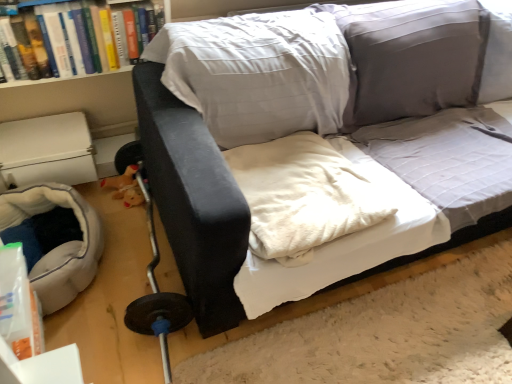
Locate an element on the screen. The image size is (512, 384). white soft blanket at center is located at coordinates (302, 196).

Describe the element at coordinates (57, 246) in the screenshot. I see `soft gray fabric bean bag at lower left` at that location.

This screenshot has height=384, width=512. I want to click on white soft blanket at center, so click(x=302, y=196).

Is soft gray fabric bean bag at lower left not inside hardcover book at upper left?

That's correct, soft gray fabric bean bag at lower left is outside of hardcover book at upper left.

In the scene shown: From a real-world perspective, which object stands above the other?

From a 3D spatial view, hardcover book at upper left is above.

From the image's perspective, would you say soft gray fabric bean bag at lower left is shown under hardcover book at upper left?

Correct, soft gray fabric bean bag at lower left appears lower than hardcover book at upper left in the image.

Where is `book above the velvet black couch at center (from the image's perspective)`? book above the velvet black couch at center (from the image's perspective) is located at coordinates (88, 37).

Is hardcover book at upper left oriented towards velvet black couch at center?

No, hardcover book at upper left is not aimed at velvet black couch at center.

From the image's perspective, is hardcover book at upper left located above or below velvet black couch at center?

Clearly, from the image's perspective, hardcover book at upper left is above velvet black couch at center.

Looking at the image, does hardcover book at upper left seem bigger or smaller compared to velvet black couch at center?

hardcover book at upper left is smaller than velvet black couch at center.

Can you confirm if white soft blanket at center is positioned to the right of hardcover book at upper left?

Correct, you'll find white soft blanket at center to the right of hardcover book at upper left.

Is point (275, 151) closer to viewer compared to point (131, 28)?

Yes.

Which object is further away from the camera taking this photo, white soft blanket at center or hardcover book at upper left?

hardcover book at upper left is further away from the camera.

Are white soft blanket at center and hardcover book at upper left located far from each other?

They are positioned close to each other.

Is there a large distance between hardcover book at upper left and white soft blanket at center?

That's not correct — hardcover book at upper left is a little close to white soft blanket at center.

Is hardcover book at upper left wider than white soft blanket at center?

No.

Is hardcover book at upper left completely or partially outside of white soft blanket at center?

Yes.

From the image's perspective, which one is positioned lower, white soft blanket at center or soft gray fabric bean bag at lower left?

From the image's view, soft gray fabric bean bag at lower left is below.

Is the surface of white soft blanket at center in direct contact with soft gray fabric bean bag at lower left?

white soft blanket at center is not next to soft gray fabric bean bag at lower left, and they're not touching.

This screenshot has height=384, width=512. I want to click on bean bag chair directly beneath the white soft blanket at center (from a real-world perspective), so click(57, 246).

Does white soft blanket at center have a smaller size compared to soft gray fabric bean bag at lower left?

Correct, white soft blanket at center occupies less space than soft gray fabric bean bag at lower left.

From a real-world perspective, is hardcover book at upper left positioned under soft gray fabric bean bag at lower left based on gravity?

Actually, hardcover book at upper left is physically above soft gray fabric bean bag at lower left in the real world.

What's the angular difference between hardcover book at upper left and soft gray fabric bean bag at lower left's facing directions?

89 degrees separate the facing orientations of hardcover book at upper left and soft gray fabric bean bag at lower left.

Is hardcover book at upper left oriented towards soft gray fabric bean bag at lower left?

No, hardcover book at upper left is not oriented towards soft gray fabric bean bag at lower left.

From their relative heights in the image, would you say hardcover book at upper left is taller or shorter than soft gray fabric bean bag at lower left?

hardcover book at upper left is taller than soft gray fabric bean bag at lower left.

Is point (478, 159) less distant than point (54, 12)?

No, it is not.

From the picture: From the image's perspective, between velvet black couch at center and hardcover book at upper left, who is located below?

velvet black couch at center.

Is velvet black couch at center oriented away from hardcover book at upper left?

No, hardcover book at upper left is not at the back of velvet black couch at center.

Which object is wider, velvet black couch at center or hardcover book at upper left?

velvet black couch at center is wider.

The width and height of the screenshot is (512, 384). What are the coordinates of `book located above the soft gray fabric bean bag at lower left (from a real-world perspective)` in the screenshot? It's located at (88, 37).

Locate an element on the screen. This screenshot has width=512, height=384. studio couch on the right of hardcover book at upper left is located at coordinates (193, 200).

Based on their spatial positions, is white soft blanket at center or soft gray fabric bean bag at lower left closer to velvet black couch at center?

white soft blanket at center is closer to velvet black couch at center.

Looking at the image, which one is located further to soft gray fabric bean bag at lower left, white soft blanket at center or velvet black couch at center?

Based on the image, velvet black couch at center appears to be further to soft gray fabric bean bag at lower left.

When comparing their distances from soft gray fabric bean bag at lower left, does white soft blanket at center or hardcover book at upper left seem closer?

hardcover book at upper left lies closer to soft gray fabric bean bag at lower left than the other object.

Which object lies further to the anchor point white soft blanket at center, hardcover book at upper left or soft gray fabric bean bag at lower left?

soft gray fabric bean bag at lower left is further to white soft blanket at center.

Which object lies nearer to the anchor point soft gray fabric bean bag at lower left, hardcover book at upper left or velvet black couch at center?

The object closer to soft gray fabric bean bag at lower left is hardcover book at upper left.

Based on their spatial positions, is white soft blanket at center or hardcover book at upper left further from velvet black couch at center?

Among the two, hardcover book at upper left is located further to velvet black couch at center.

Considering their positions, is white soft blanket at center positioned closer to hardcover book at upper left than soft gray fabric bean bag at lower left?

The object closer to hardcover book at upper left is soft gray fabric bean bag at lower left.

From the image, which object appears to be farther from white soft blanket at center, velvet black couch at center or hardcover book at upper left?

hardcover book at upper left is positioned further to the anchor white soft blanket at center.

The width and height of the screenshot is (512, 384). I want to click on linen between soft gray fabric bean bag at lower left and velvet black couch at center from left to right, so click(302, 196).

Find the location of a particular element. The image size is (512, 384). linen between hardcover book at upper left and velvet black couch at center is located at coordinates (302, 196).

Find the location of a particular element. book between soft gray fabric bean bag at lower left and velvet black couch at center in the horizontal direction is located at coordinates (88, 37).

At what (x,y) coordinates should I click in order to perform the action: click on book between soft gray fabric bean bag at lower left and white soft blanket at center. Please return your answer as a coordinate pair (x, y). This screenshot has height=384, width=512. Looking at the image, I should click on (88, 37).